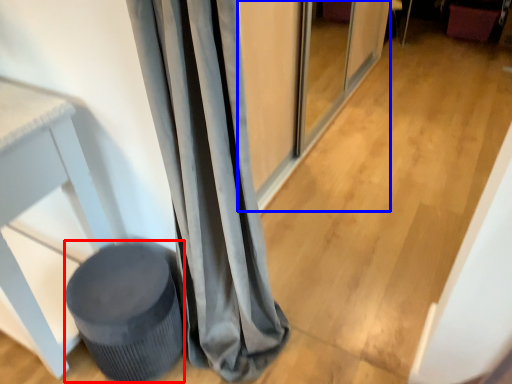
Question: Among these objects, which one is farthest to the camera, music stool (highlighted by a red box) or screen door (highlighted by a blue box)?

Choices:
 (A) music stool
 (B) screen door

Answer: (B)